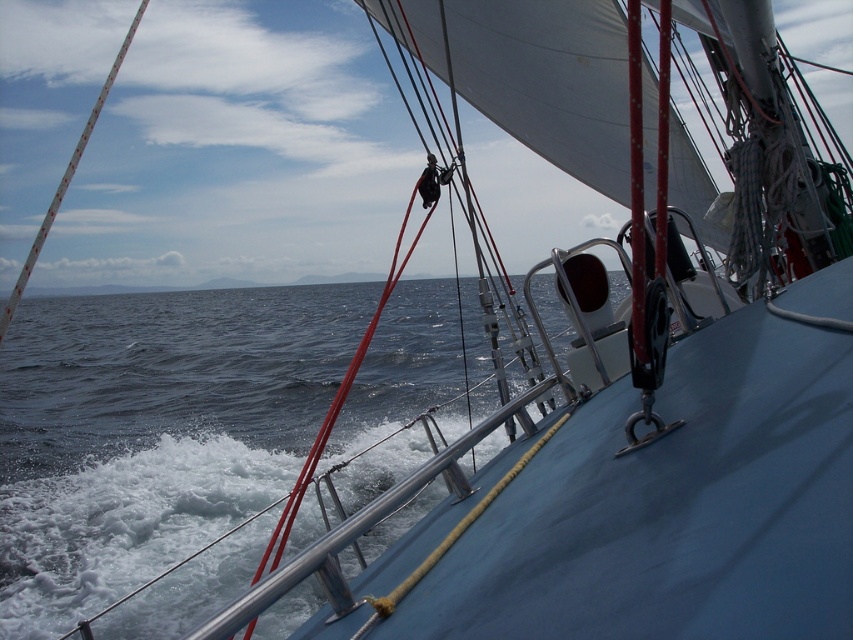
Between blue water at lower left and white textured pole at upper left, which one appears on the right side from the viewer's perspective?

blue water at lower left is more to the right.

Does blue water at lower left have a smaller size compared to white textured pole at upper left?

Yes, blue water at lower left is smaller than white textured pole at upper left.

Is point (96, 497) closer to camera compared to point (12, 291)?

Yes, point (96, 497) is in front of point (12, 291).

Identify the location of blue water at lower left. This screenshot has height=640, width=853. (152, 432).